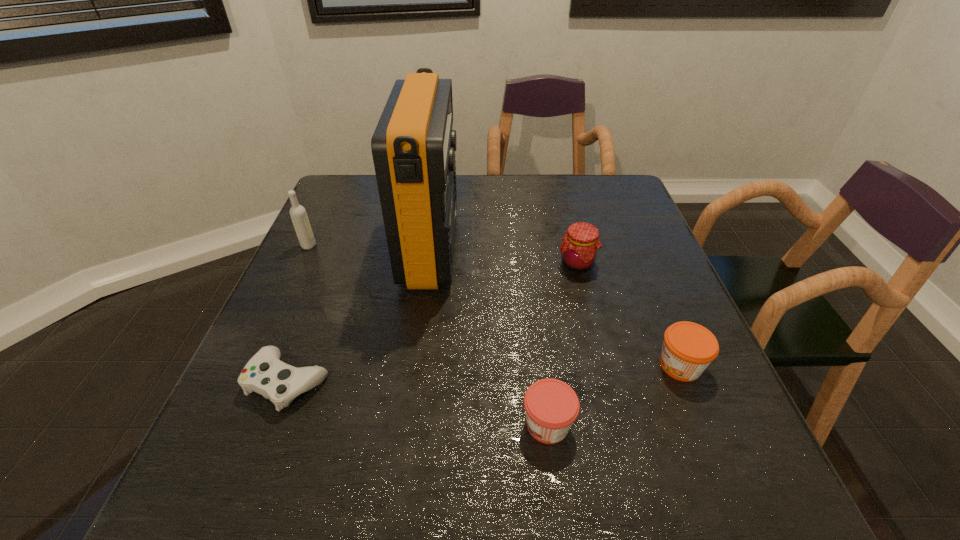
In order to click on object that is positioned at the far edge in this screenshot , I will do click(x=413, y=146).

Identify the location of vodka at the left edge. (298, 214).

Image resolution: width=960 pixels, height=540 pixels. I want to click on control present at the left edge, so click(265, 374).

You are a GUI agent. You are given a task and a screenshot of the screen. Output one action in this format:
    pyautogui.click(x=<x>, y=<y>)
    Task: Click on the object that is at the right edge
    
    Given the screenshot: What is the action you would take?
    pyautogui.click(x=688, y=348)

Locate an element on the screen. The width and height of the screenshot is (960, 540). free space at the far edge of the desktop is located at coordinates (515, 187).

In the image, there is a desktop. Where is `vacant space at the near edge`? Image resolution: width=960 pixels, height=540 pixels. vacant space at the near edge is located at coordinates (302, 475).

Where is `free space at the left edge`? free space at the left edge is located at coordinates [x=237, y=433].

The image size is (960, 540). I want to click on free region at the right edge of the desktop, so click(688, 316).

Identify the location of vacant space at the far left corner of the desktop. (344, 197).

In the image, there is a desktop. Where is `free space at the near left corner`? This screenshot has height=540, width=960. free space at the near left corner is located at coordinates (204, 501).